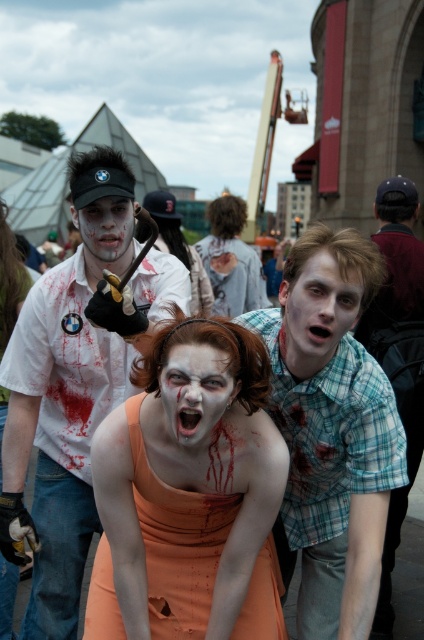
You are a photographer at a zombie event. You need to capture a clear shot of the pale matte face at center without the matte white shirt at center blocking it. How should you adjust your camera angle?

The matte white shirt at center is positioned over the pale matte face at center, so you should angle your camera downward to avoid the shirt blocking the face.